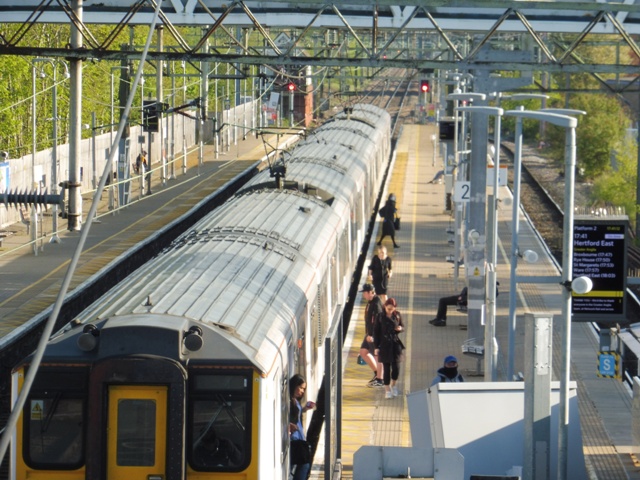
At what (x,y) coordinates should I click in order to perform the action: click on red lights. Please return your answer as a coordinate pair (x, y). This screenshot has height=480, width=640. Looking at the image, I should click on (420, 88), (290, 89).